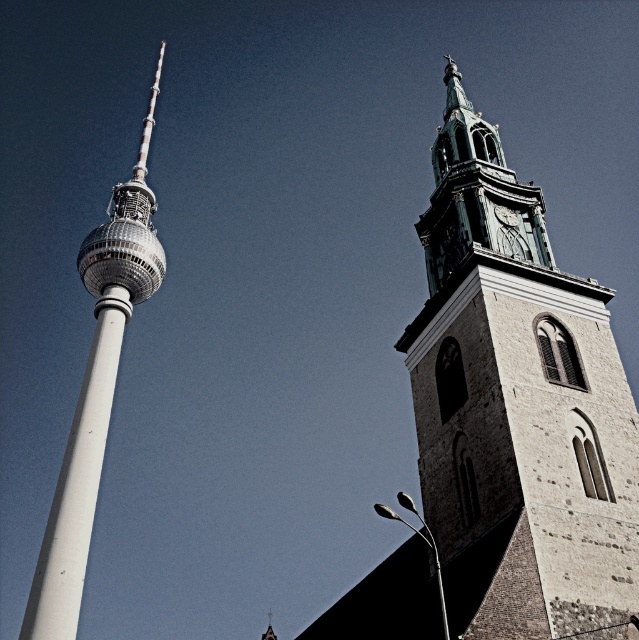
Question: Does stone tower at right have a greater width compared to white smooth pole at left?

Choices:
 (A) no
 (B) yes

Answer: (B)

Question: Which of the following is the farthest from the observer?

Choices:
 (A) (626, 380)
 (B) (98, 376)

Answer: (B)

Question: Among these objects, which one is nearest to the camera?

Choices:
 (A) white smooth pole at left
 (B) stone tower at right

Answer: (B)

Question: Which object appears farthest from the camera in this image?

Choices:
 (A) stone tower at right
 (B) white smooth pole at left

Answer: (B)

Question: From the image, what is the correct spatial relationship of stone tower at right in relation to white smooth pole at left?

Choices:
 (A) left
 (B) right

Answer: (B)

Question: Can you confirm if stone tower at right is positioned above white smooth pole at left?

Choices:
 (A) no
 (B) yes

Answer: (B)